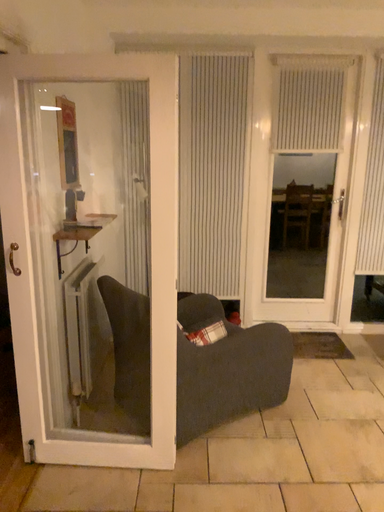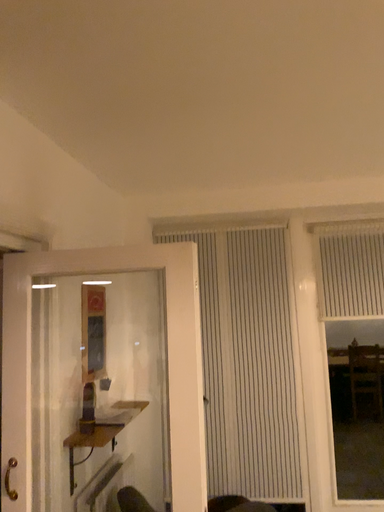
Question: Which way did the camera rotate in the video?

Choices:
 (A) rotated left
 (B) rotated right

Answer: (A)